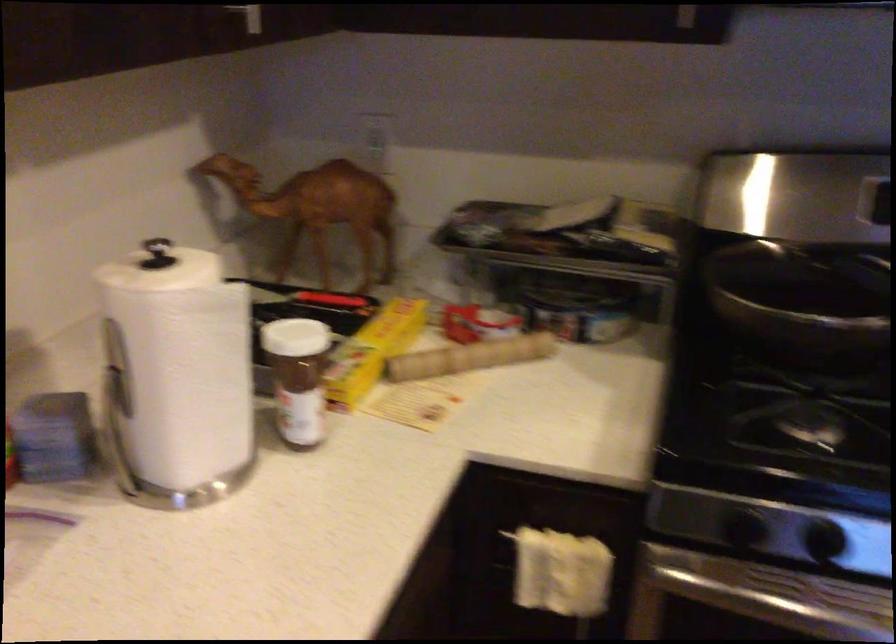
Find where to push the black stove knob. Please return your answer as a coordinate pair (x, y).

(823, 547)